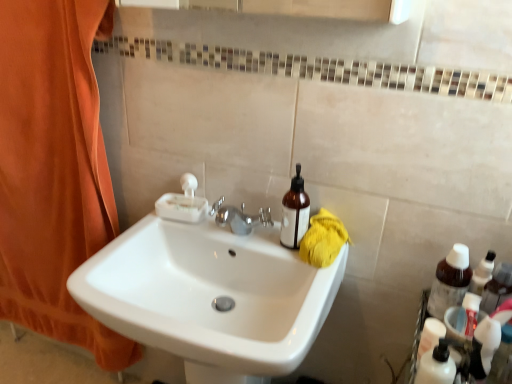
Question: Is brown translucent bottle at right in front of or behind white glossy sink at center in the image?

Choices:
 (A) front
 (B) behind

Answer: (B)

Question: Is brown translucent bottle at right wider or thinner than white glossy sink at center?

Choices:
 (A) wide
 (B) thin

Answer: (B)

Question: Estimate the real-world distances between objects in this image. Which object is closer to the brown translucent bottle at right?

Choices:
 (A) white plastic pump bottle at lower right
 (B) white glossy sink at center
 (C) brown glass bottle at right
 (D) orange fabric curtain at left

Answer: (A)

Question: Which of these objects is positioned farthest from the brown translucent bottle at right?

Choices:
 (A) orange fabric curtain at left
 (B) brown glass bottle at right
 (C) white plastic pump bottle at lower right
 (D) white glossy sink at center

Answer: (A)